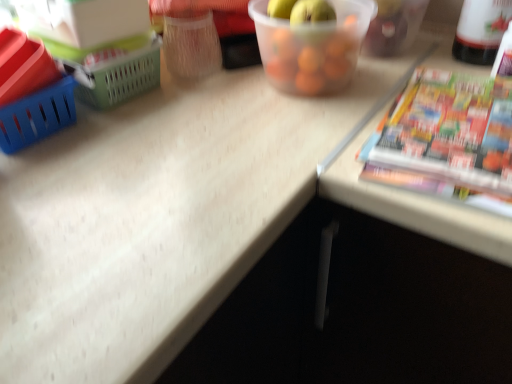
Question: Which direction should I rotate to look at translucent plastic container at upper center?

Choices:
 (A) right
 (B) left

Answer: (A)

Question: Is translucent plastic container at upper center thinner than multicolored glossy paperback book at right?

Choices:
 (A) yes
 (B) no

Answer: (A)

Question: Does translucent plastic container at upper center contain multicolored glossy paperback book at right?

Choices:
 (A) no
 (B) yes

Answer: (A)

Question: Is translucent plastic container at upper center positioned in front of multicolored glossy paperback book at right?

Choices:
 (A) no
 (B) yes

Answer: (A)

Question: Is translucent plastic container at upper center bigger than multicolored glossy paperback book at right?

Choices:
 (A) yes
 (B) no

Answer: (A)

Question: From the image's perspective, is translucent plastic container at upper center under multicolored glossy paperback book at right?

Choices:
 (A) yes
 (B) no

Answer: (B)

Question: Does translucent plastic container at upper center have a greater height compared to multicolored glossy paperback book at right?

Choices:
 (A) yes
 (B) no

Answer: (A)

Question: Does white plastic bottle at upper right come behind multicolored glossy paperback book at right?

Choices:
 (A) no
 (B) yes

Answer: (B)

Question: Is white plastic bottle at upper right shorter than multicolored glossy paperback book at right?

Choices:
 (A) no
 (B) yes

Answer: (A)

Question: Can you confirm if white plastic bottle at upper right is taller than multicolored glossy paperback book at right?

Choices:
 (A) no
 (B) yes

Answer: (B)

Question: Can multicolored glossy paperback book at right be found inside white plastic bottle at upper right?

Choices:
 (A) no
 (B) yes

Answer: (A)

Question: Considering the relative sizes of white plastic bottle at upper right and multicolored glossy paperback book at right in the image provided, is white plastic bottle at upper right bigger than multicolored glossy paperback book at right?

Choices:
 (A) no
 (B) yes

Answer: (B)

Question: From the image's perspective, is white plastic bottle at upper right over multicolored glossy paperback book at right?

Choices:
 (A) yes
 (B) no

Answer: (A)

Question: Is white plastic bottle at upper right completely or partially inside translucent plastic container at upper center?

Choices:
 (A) yes
 (B) no

Answer: (B)